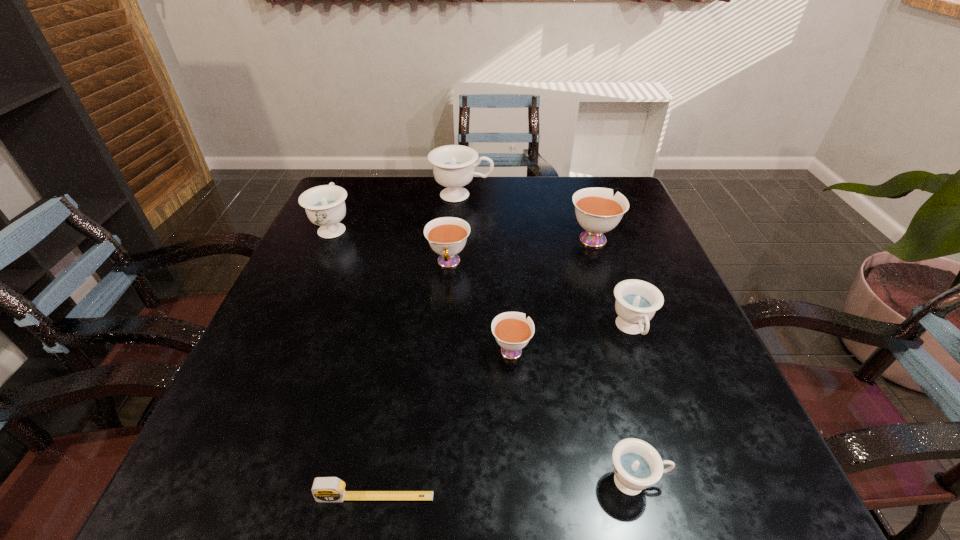
The width and height of the screenshot is (960, 540). In order to click on free spot between the farthest object and the rightmost white teacup in this screenshot , I will do 527,217.

Where is `vacant region between the second nearest blue teacup and the nearest blue teacup`? This screenshot has width=960, height=540. vacant region between the second nearest blue teacup and the nearest blue teacup is located at coordinates (634, 406).

Image resolution: width=960 pixels, height=540 pixels. What are the coordinates of `unoccupied area between the shortest object and the third nearest blue teacup` in the screenshot? It's located at (354, 362).

Locate an element on the screen. This screenshot has width=960, height=540. object that is the closest to the nearest blue teacup is located at coordinates (512, 331).

Identify which object is located as the fourth nearest to the smallest blue teacup. Please provide its 2D coordinates. Your answer should be formatted as a tuple, i.e. [(x, y)], where the tuple contains the x and y coordinates of a point satisfying the conditions above.

[(447, 236)]

Point out which teacup is positioned as the second nearest to the leftmost white teacup. Please provide its 2D coordinates. Your answer should be formatted as a tuple, i.e. [(x, y)], where the tuple contains the x and y coordinates of a point satisfying the conditions above.

[(453, 165)]

Identify the location of teacup that is the sixth closest one to the nearest white teacup. (453, 165).

Locate an element on the screen. The image size is (960, 540). blue teacup that stands as the closest to the smallest white teacup is located at coordinates (637, 301).

Image resolution: width=960 pixels, height=540 pixels. I want to click on blue teacup that is the second nearest to the biggest blue teacup, so click(637, 301).

Select which white teacup is the closest to the shortest object. Please provide its 2D coordinates. Your answer should be formatted as a tuple, i.e. [(x, y)], where the tuple contains the x and y coordinates of a point satisfying the conditions above.

[(512, 331)]